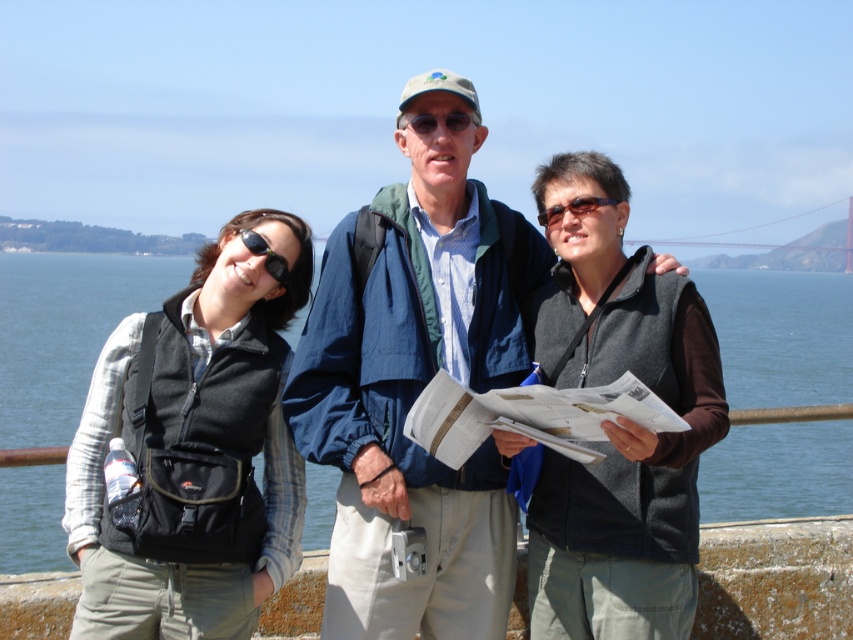
At what (x,y) coordinates should I click in order to perform the action: click on blue fabric jacket at center. Please return your answer as a coordinate pair (x, y). Image resolution: width=853 pixels, height=640 pixels. Looking at the image, I should click on (416, 378).

Does blue fabric jacket at center have a lesser width compared to blue water at center?

Yes, blue fabric jacket at center is thinner than blue water at center.

Is point (375, 308) farther from viewer compared to point (845, 364)?

That is False.

The image size is (853, 640). I want to click on blue fabric jacket at center, so click(416, 378).

Between dark gray fleece vest at center and blue water at center, which one has more height?

Standing taller between the two is blue water at center.

Locate an element on the screen. This screenshot has width=853, height=640. dark gray fleece vest at center is located at coordinates (616, 420).

Where is `dark gray fleece vest at center`? dark gray fleece vest at center is located at coordinates (616, 420).

Can you confirm if dark gray fleece vest at center is positioned above black fleece vest at left?

Correct, dark gray fleece vest at center is located above black fleece vest at left.

Does dark gray fleece vest at center have a lesser height compared to black fleece vest at left?

In fact, dark gray fleece vest at center may be taller than black fleece vest at left.

This screenshot has height=640, width=853. I want to click on dark gray fleece vest at center, so click(616, 420).

Find the location of a particular element. The image size is (853, 640). dark gray fleece vest at center is located at coordinates (616, 420).